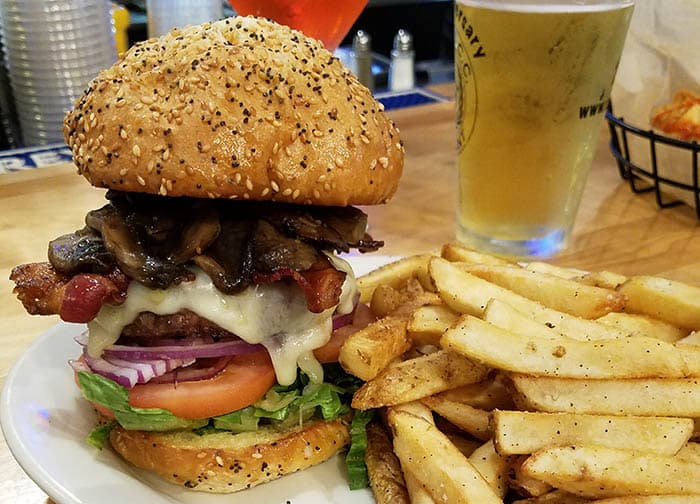
At what (x,y) coordinates should I click in order to perform the action: click on salt shaker. Please return your answer as a coordinate pair (x, y). Looking at the image, I should click on click(x=402, y=65).